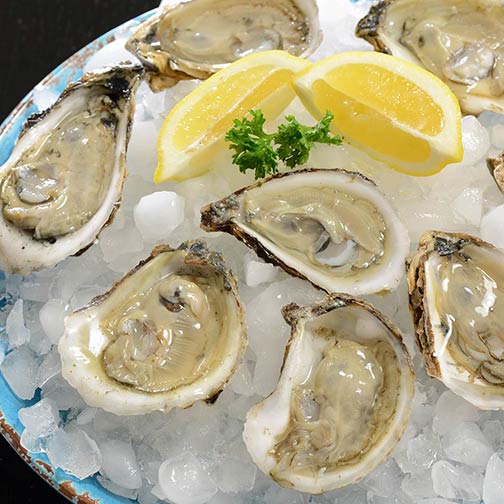
The width and height of the screenshot is (504, 504). I want to click on blue bowl, so click(x=88, y=485).